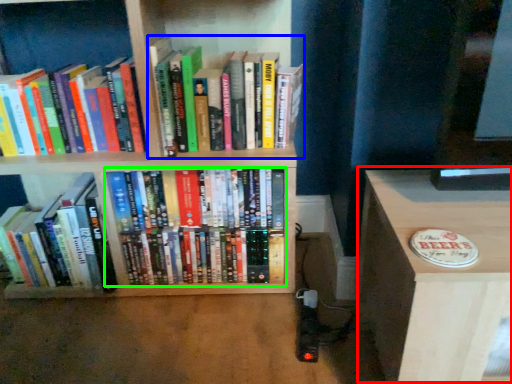
Question: Which object is the closest to the table (highlighted by a red box)? Choose among these: book (highlighted by a blue box) or book (highlighted by a green box).

Choices:
 (A) book
 (B) book

Answer: (B)